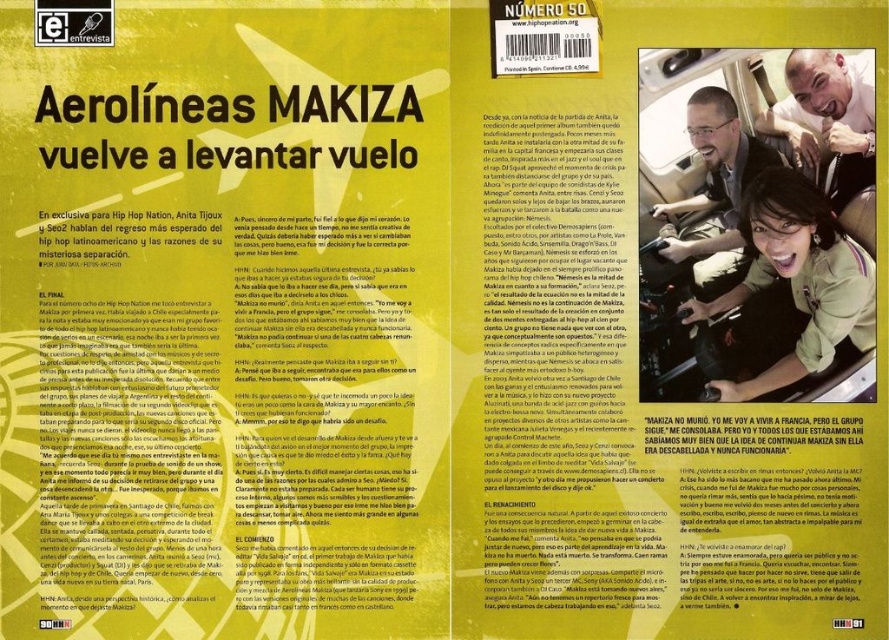
Question: Is matte black hair at upper right positioned in front of matte black face at upper right?

Choices:
 (A) no
 (B) yes

Answer: (A)

Question: Can you confirm if matte black face at upper right is wider than matte black man at upper right?

Choices:
 (A) yes
 (B) no

Answer: (B)

Question: Is matte black face at upper right to the left of matte black man at upper right from the viewer's perspective?

Choices:
 (A) no
 (B) yes

Answer: (A)

Question: Which point is farther to the camera?

Choices:
 (A) (791, 374)
 (B) (647, 448)
 (C) (717, 276)

Answer: (B)

Question: Which of the following is the farthest from the observer?

Choices:
 (A) (803, 227)
 (B) (866, 157)

Answer: (A)

Question: Among these objects, which one is nearest to the camera?

Choices:
 (A) matte black face at upper right
 (B) matte black man at upper right
 (C) matte black hair at upper right

Answer: (A)